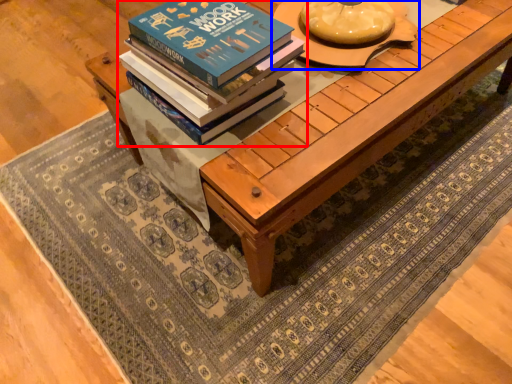
Question: Which object is closer to the camera taking this photo, book (highlighted by a red box) or round table (highlighted by a blue box)?

Choices:
 (A) book
 (B) round table

Answer: (A)